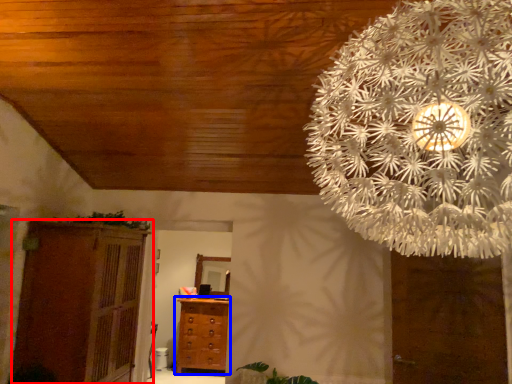
Question: Which object appears farthest to the camera in this image, cupboard (highlighted by a red box) or chest of drawers (highlighted by a blue box)?

Choices:
 (A) cupboard
 (B) chest of drawers

Answer: (B)